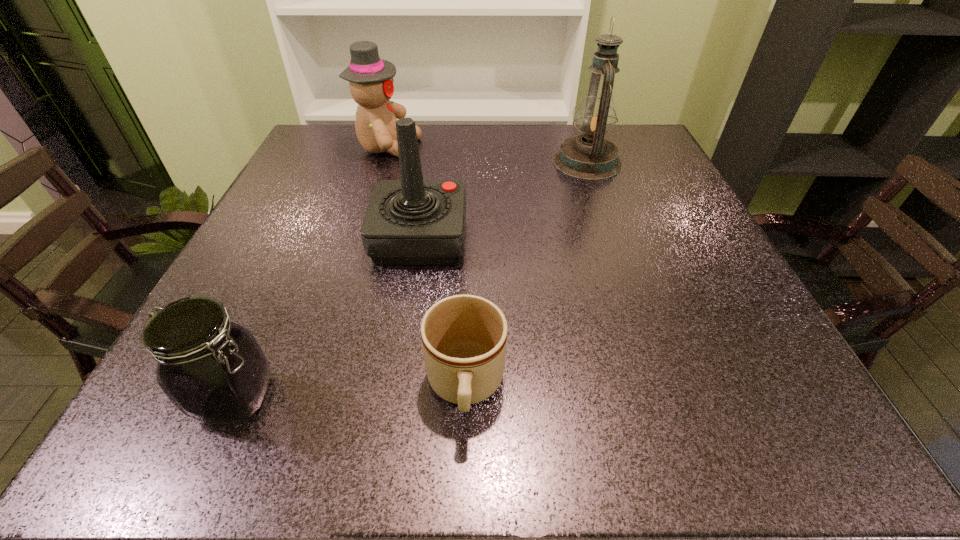
Find the location of a particular element. unoccupied position between the joystick and the tallest object is located at coordinates (504, 200).

The width and height of the screenshot is (960, 540). In order to click on free space between the jar and the rightmost object in this screenshot , I will do `click(412, 280)`.

Where is `free space between the rag_doll and the rightmost object`? This screenshot has height=540, width=960. free space between the rag_doll and the rightmost object is located at coordinates (488, 156).

Image resolution: width=960 pixels, height=540 pixels. Identify the location of object that can be found as the second closest to the third farthest object. (370, 78).

Point out which object is positioned as the third nearest to the third farthest object. Please provide its 2D coordinates. Your answer should be formatted as a tuple, i.e. [(x, y)], where the tuple contains the x and y coordinates of a point satisfying the conditions above.

[(213, 370)]

In order to click on free space that satisfies the following two spatial constraints: 1. on the side of the mug with the handle; 2. on the lid of the second shortest object in this screenshot , I will do tap(466, 397).

Locate an element on the screen. free space that satisfies the following two spatial constraints: 1. on the side of the mug with the handle; 2. on the lid of the jar is located at coordinates (466, 397).